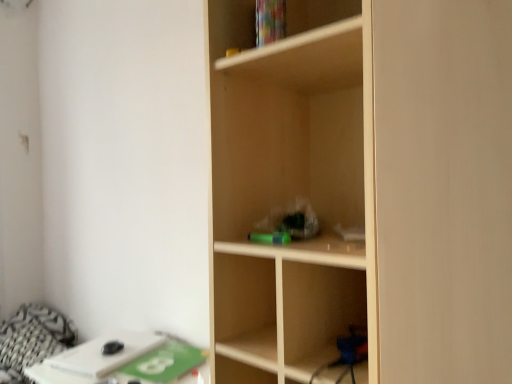
Question: Is patterned fabric bedding at lower left facing away from white matte table at lower left?

Choices:
 (A) no
 (B) yes

Answer: (A)

Question: From the image's perspective, is patterned fabric bedding at lower left under white matte table at lower left?

Choices:
 (A) no
 (B) yes

Answer: (B)

Question: From a real-world perspective, is patterned fabric bedding at lower left positioned under white matte table at lower left based on gravity?

Choices:
 (A) no
 (B) yes

Answer: (B)

Question: Is patterned fabric bedding at lower left completely or partially outside of white matte table at lower left?

Choices:
 (A) no
 (B) yes

Answer: (B)

Question: Does patterned fabric bedding at lower left have a greater width compared to white matte table at lower left?

Choices:
 (A) yes
 (B) no

Answer: (A)

Question: From their relative heights in the image, would you say green matte paperback book at lower left is taller or shorter than light wood shelf at center?

Choices:
 (A) tall
 (B) short

Answer: (B)

Question: Considering their positions, is green matte paperback book at lower left located in front of or behind light wood shelf at center?

Choices:
 (A) front
 (B) behind

Answer: (B)

Question: From a real-world perspective, is green matte paperback book at lower left above or below light wood shelf at center?

Choices:
 (A) below
 (B) above

Answer: (A)

Question: Looking at the image, does green matte paperback book at lower left seem bigger or smaller compared to light wood shelf at center?

Choices:
 (A) big
 (B) small

Answer: (B)

Question: Do you think light wood shelf at center is within green matte paperback book at lower left, or outside of it?

Choices:
 (A) outside
 (B) inside

Answer: (A)

Question: Does point (215, 271) appear closer or farther from the camera than point (178, 349)?

Choices:
 (A) closer
 (B) farther

Answer: (A)

Question: From the image's perspective, is light wood shelf at center above or below green matte paperback book at lower left?

Choices:
 (A) below
 (B) above

Answer: (B)

Question: Would you say light wood shelf at center is to the left or to the right of green matte paperback book at lower left in the picture?

Choices:
 (A) right
 (B) left

Answer: (A)

Question: Is patterned fabric bedding at lower left in front of or behind white matte table at lower left in the image?

Choices:
 (A) front
 (B) behind

Answer: (B)

Question: From the image's perspective, relative to white matte table at lower left, is patterned fabric bedding at lower left above or below?

Choices:
 (A) below
 (B) above

Answer: (A)